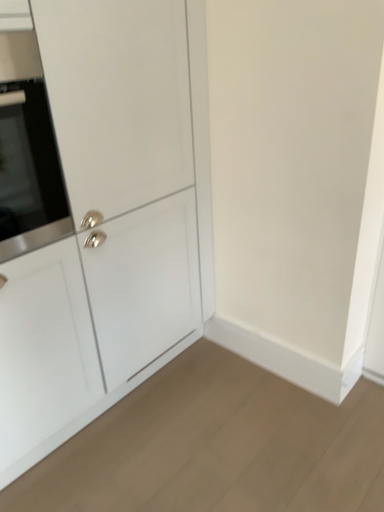
Question: Looking at their shapes, would you say white matte cabinet at center is wider or thinner than satin silver oven at left?

Choices:
 (A) wide
 (B) thin

Answer: (A)

Question: From a real-world perspective, relative to satin silver oven at left, is white matte cabinet at center vertically above or below?

Choices:
 (A) above
 (B) below

Answer: (B)

Question: Is point (122, 343) closer or farther from the camera than point (34, 106)?

Choices:
 (A) farther
 (B) closer

Answer: (A)

Question: Considering the positions of satin silver oven at left and white matte cabinet at center in the image, is satin silver oven at left wider or thinner than white matte cabinet at center?

Choices:
 (A) wide
 (B) thin

Answer: (B)

Question: Considering the positions of point (34, 93) and point (99, 180), is point (34, 93) closer or farther from the camera than point (99, 180)?

Choices:
 (A) closer
 (B) farther

Answer: (A)

Question: From the image's perspective, is satin silver oven at left positioned above or below white matte cabinet at center?

Choices:
 (A) below
 (B) above

Answer: (B)

Question: Do you think satin silver oven at left is within white matte cabinet at center, or outside of it?

Choices:
 (A) outside
 (B) inside

Answer: (B)